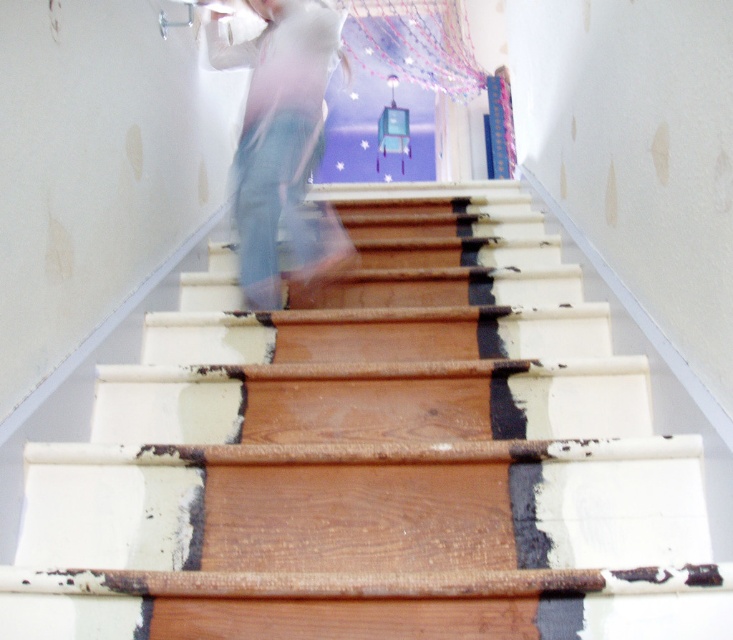
You are standing at the bottom of the wooden stairs at center and want to reach the top where the doorway is. The light blue jeans at center are blocking your path. Can you move around them to the right to continue upwards?

The wooden stairs at center is positioned on the right side of light blue jeans at center, so moving to the right would take you away from the stairs. You should move to the left instead to reach the wooden stairs at center and continue upwards.

You are standing at the bottom of the wooden stairs at center and want to reach the doorway at the top. The light blue jeans at center are blocking your path. Can you move around them to continue upwards?

The wooden stairs at center is positioned under light blue jeans at center, meaning the light blue jeans are above the stairs. Since the stairs are below the jeans, you can move around the jeans by stepping onto the wooden stairs at center to continue upwards.